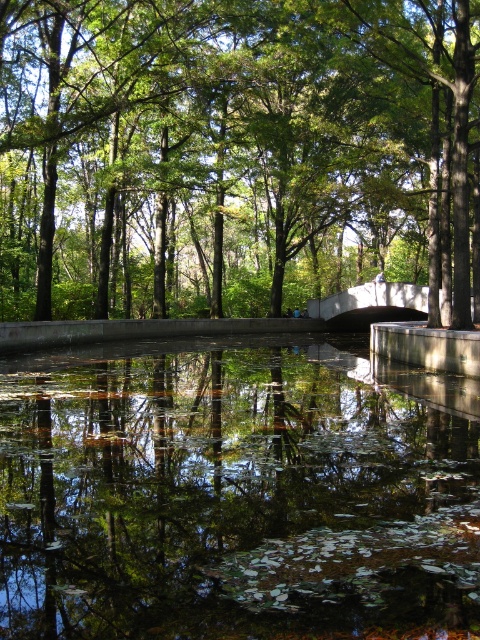
Question: Does green leafy tree at center have a larger size compared to transparent water at center?

Choices:
 (A) no
 (B) yes

Answer: (B)

Question: Can you confirm if green leafy tree at center is wider than transparent water at center?

Choices:
 (A) no
 (B) yes

Answer: (B)

Question: In this image, where is green leafy tree at center located relative to transparent water at center?

Choices:
 (A) below
 (B) above

Answer: (B)

Question: Among these objects, which one is farthest from the camera?

Choices:
 (A) green leafy tree at center
 (B) transparent water at center

Answer: (A)